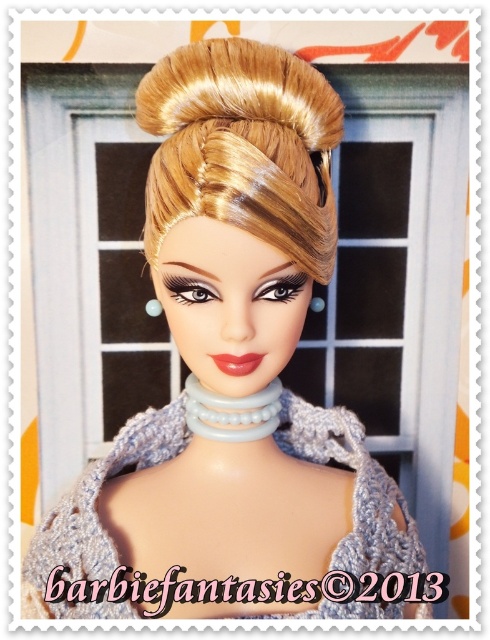
Who is more distant from viewer, (175, 200) or (340, 442)?

The point (340, 442) is more distant.

Between point (207, 164) and point (104, 612), which one is positioned behind?

The point (104, 612) is behind.

Where is `blonde shiny hair bun at upper center`? The image size is (490, 640). blonde shiny hair bun at upper center is located at coordinates (243, 147).